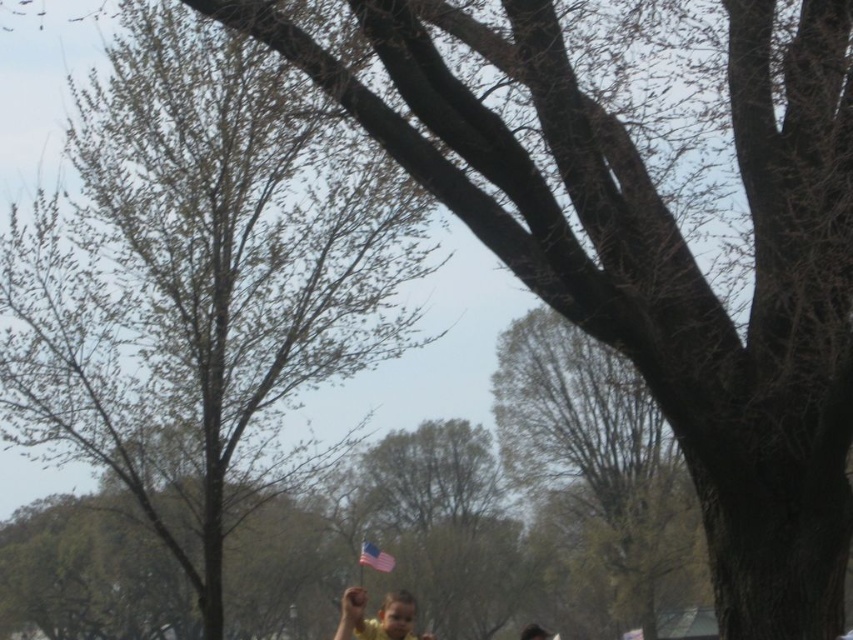
Can you confirm if yellow matte shirt at lower center is positioned above american flag at center?

Actually, yellow matte shirt at lower center is below american flag at center.

Measure the distance between yellow matte shirt at lower center and camera.

The distance of yellow matte shirt at lower center from camera is 14.36 meters.

The width and height of the screenshot is (853, 640). Find the location of `yellow matte shirt at lower center`. yellow matte shirt at lower center is located at coordinates (376, 618).

Which is behind, point (569, 324) or point (361, 548)?

The point (569, 324) is more distant.

Is point (519, 454) less distant than point (380, 557)?

No, it is not.

Identify the location of smooth bark tree at center. (602, 464).

What do you see at coordinates (602, 464) in the screenshot? The width and height of the screenshot is (853, 640). I see `smooth bark tree at center` at bounding box center [602, 464].

Can you confirm if smooth bark tree at center is bigger than yellow matte shirt at lower center?

Correct, smooth bark tree at center is larger in size than yellow matte shirt at lower center.

Is point (601, 371) positioned behind point (396, 604)?

Yes, it is behind point (396, 604).

Find the location of a particular element. smooth bark tree at center is located at coordinates (602, 464).